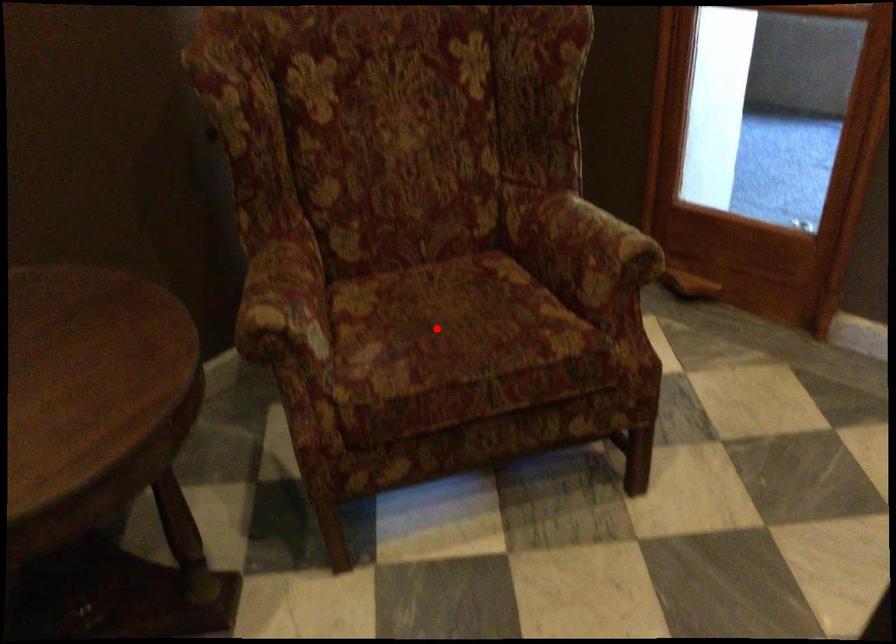
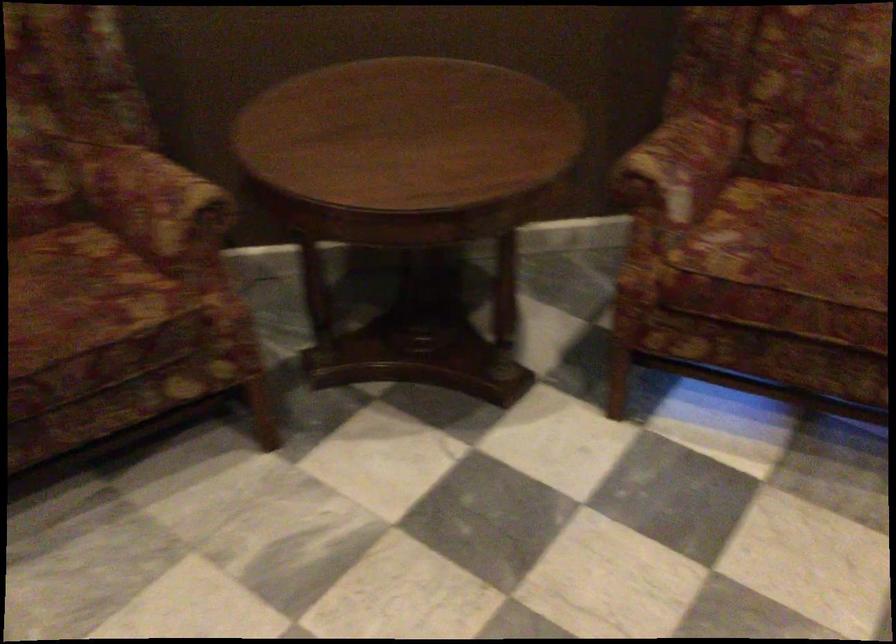
Where in the second image is the point corresponding to the highlighted location from the first image?

(794, 243)